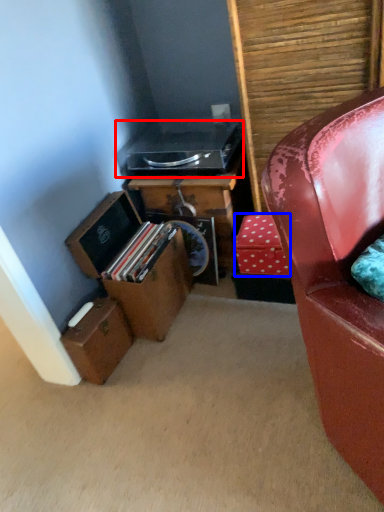
Question: Which of the following is the farthest to the observer, stereo (highlighted by a red box) or cardboard box (highlighted by a blue box)?

Choices:
 (A) stereo
 (B) cardboard box

Answer: (A)